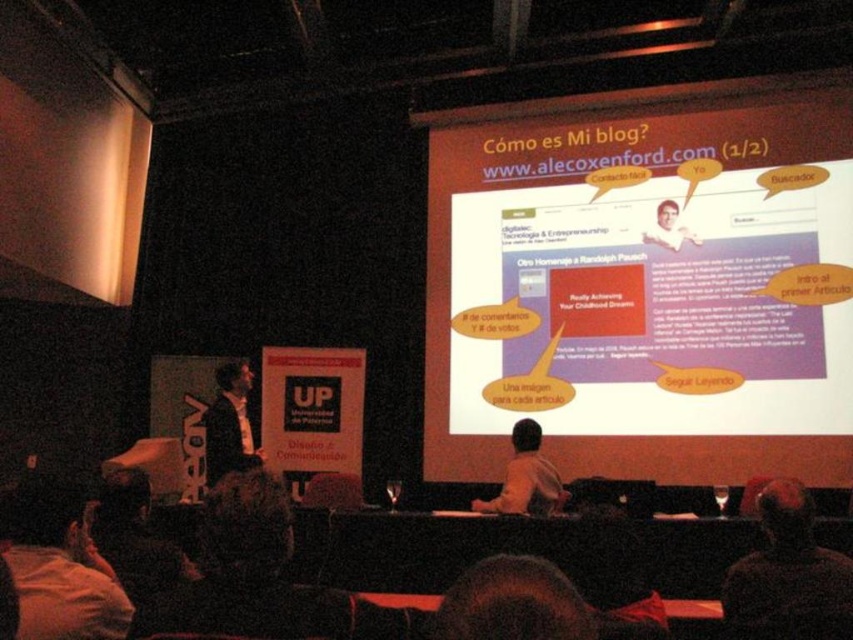
Question: Is white glossy projection screen at upper center bigger than dark brown leather jacket at lower right?

Choices:
 (A) no
 (B) yes

Answer: (B)

Question: Is white glossy projection screen at upper center positioned before dark fabric pillow at lower left?

Choices:
 (A) no
 (B) yes

Answer: (A)

Question: Is white glossy projection screen at upper center thinner than dark brown leather jacket at lower right?

Choices:
 (A) yes
 (B) no

Answer: (B)

Question: Among these objects, which one is nearest to the camera?

Choices:
 (A) white glossy projection screen at upper center
 (B) light brown suit at center
 (C) dark brown leather jacket at lower right
 (D) light brown shirt at center

Answer: (C)

Question: Which is nearer to the white glossy projection screen at upper center?

Choices:
 (A) light brown shirt at center
 (B) light brown suit at center

Answer: (A)

Question: Which of these objects is positioned closest to the dark fabric pillow at lower left?

Choices:
 (A) light brown suit at center
 (B) light brown shirt at center
 (C) dark brown leather jacket at lower right

Answer: (C)